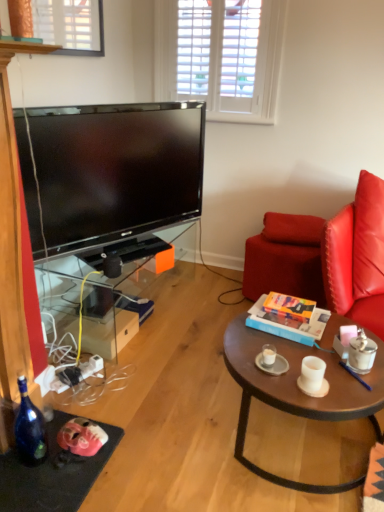
Where is `space that is in front of white matte coffee cup at center right, the second coffee cup when ordered from left to right`? space that is in front of white matte coffee cup at center right, the second coffee cup when ordered from left to right is located at coordinates (325, 399).